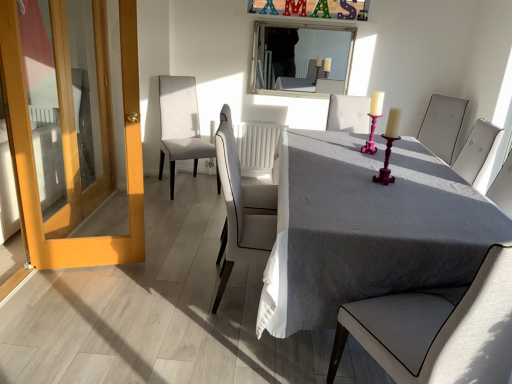
Question: Is gray fabric table at center further to the viewer compared to matte white chair at center, the third chair in the front-to-back sequence?

Choices:
 (A) no
 (B) yes

Answer: (A)

Question: Considering the relative sizes of gray fabric table at center and matte white chair at center, the 3th chair viewed from the back, in the image provided, is gray fabric table at center wider than matte white chair at center, the 3th chair viewed from the back,?

Choices:
 (A) no
 (B) yes

Answer: (B)

Question: Is matte white chair at center, the third chair in the front-to-back sequence, at the back of gray fabric table at center?

Choices:
 (A) yes
 (B) no

Answer: (B)

Question: Is gray fabric table at center to the left of matte white chair at center, the 3th chair viewed from the back, from the viewer's perspective?

Choices:
 (A) no
 (B) yes

Answer: (B)

Question: Is gray fabric table at center at the right side of matte white chair at center, the 3th chair viewed from the back?

Choices:
 (A) yes
 (B) no

Answer: (B)

Question: From a real-world perspective, is gray fabric table at center physically below matte white chair at center, the third chair in the front-to-back sequence?

Choices:
 (A) yes
 (B) no

Answer: (A)

Question: Is white leather chair at center, which appears as the second chair when viewed from the left, to the left of matte white chair at center, which is the 4th chair from left to right, from the viewer's perspective?

Choices:
 (A) no
 (B) yes

Answer: (B)

Question: Is white leather chair at center, which is counted as the fourth chair, starting from the back, next to matte white chair at center, the third chair in the front-to-back sequence?

Choices:
 (A) no
 (B) yes

Answer: (A)

Question: Is white leather chair at center, which is counted as the fourth chair, starting from the back, bigger than matte white chair at center, which is the 4th chair from left to right?

Choices:
 (A) no
 (B) yes

Answer: (B)

Question: Could you tell me if white leather chair at center, which is counted as the fourth chair, starting from the back, is facing matte white chair at center, the 3th chair viewed from the back?

Choices:
 (A) yes
 (B) no

Answer: (B)

Question: Is white leather chair at center, the second chair in the front-to-back sequence, taller than matte white chair at center, the 3th chair viewed from the back?

Choices:
 (A) no
 (B) yes

Answer: (B)

Question: Is white leather chair at center, which is counted as the fourth chair, starting from the back, not near matte white chair at center, which is the 4th chair from left to right?

Choices:
 (A) yes
 (B) no

Answer: (A)

Question: Is the surface of light beige fabric chair at center, which ranks as the 5th chair in front-to-back order, in direct contact with white leather chair at center, which appears as the second chair when viewed from the left?

Choices:
 (A) no
 (B) yes

Answer: (A)